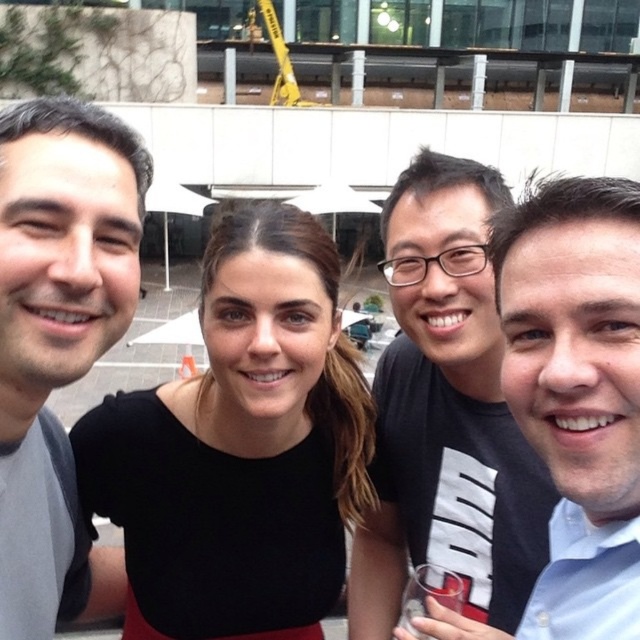
Question: Which object is closer to the camera taking this photo?

Choices:
 (A) matte gray shirt at left
 (B) clear plastic cup at lower center
 (C) black matte shirt at upper right
 (D) blue shirt at right

Answer: (D)

Question: From the image, what is the correct spatial relationship of black matte dress at center in relation to clear plastic cup at lower center?

Choices:
 (A) above
 (B) below

Answer: (A)

Question: Is black matte shirt at upper right thinner than clear plastic cup at lower center?

Choices:
 (A) yes
 (B) no

Answer: (B)

Question: Which of the following is the closest to the observer?

Choices:
 (A) (497, 339)
 (B) (88, 205)
 (C) (177, 600)

Answer: (B)

Question: Which object is the closest to the black matte dress at center?

Choices:
 (A) matte gray shirt at left
 (B) black matte shirt at upper right
 (C) blue shirt at right

Answer: (A)

Question: Is black matte dress at center bigger than black matte shirt at upper right?

Choices:
 (A) yes
 (B) no

Answer: (B)